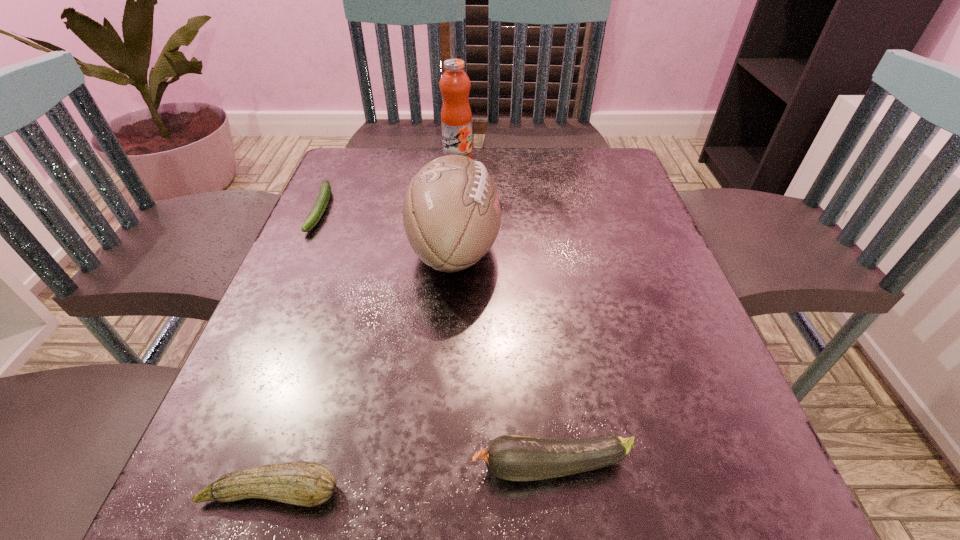
In the image, there is a desktop. Find the location of `blank space at the far left corner`. blank space at the far left corner is located at coordinates (349, 156).

In the image, there is a desktop. Identify the location of vacant space at the far right corner. (600, 152).

Locate an element on the screen. The width and height of the screenshot is (960, 540). free space between the rightmost zucchini and the football (American) is located at coordinates (503, 357).

This screenshot has height=540, width=960. I want to click on free point between the rightmost zucchini and the fruit juice, so click(505, 312).

This screenshot has width=960, height=540. I want to click on free space between the shortest zucchini and the rightmost zucchini, so click(437, 338).

Where is `free area in between the tallest object and the farthest zucchini`? The width and height of the screenshot is (960, 540). free area in between the tallest object and the farthest zucchini is located at coordinates (390, 184).

Find the location of `free space that is in between the football (American) and the rightmost zucchini`. free space that is in between the football (American) and the rightmost zucchini is located at coordinates (503, 357).

This screenshot has height=540, width=960. In order to click on vacant region between the fruit juice and the rightmost zucchini in this screenshot , I will do `click(505, 312)`.

Where is `free space between the fruit juice and the shortest zucchini`? This screenshot has width=960, height=540. free space between the fruit juice and the shortest zucchini is located at coordinates (390, 184).

Identify which object is located as the nearest to the fourth shortest object. Please provide its 2D coordinates. Your answer should be formatted as a tuple, i.e. [(x, y)], where the tuple contains the x and y coordinates of a point satisfying the conditions above.

[(456, 118)]